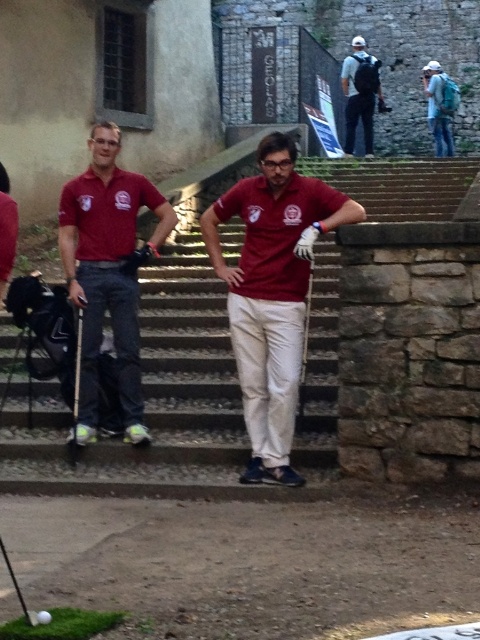
Question: Can you confirm if matte blue backpack at upper right is bigger than matte black golf club at center?

Choices:
 (A) no
 (B) yes

Answer: (B)

Question: Based on their relative distances, which object is farther from the white matte golf ball at center?

Choices:
 (A) matte gray backpack at upper right
 (B) matte blue backpack at upper right
 (C) matte black golf club at center
 (D) matte red polo shirt at center

Answer: (B)

Question: Among these points, which one is farthest from the camera?

Choices:
 (A) 80,356
 (B) 96,400
 (C) 345,60

Answer: (C)

Question: From the image, what is the correct spatial relationship of matte red polo shirt at center in relation to matte black golf club at center?

Choices:
 (A) right
 (B) left

Answer: (A)

Question: Considering the relative positions of matte khaki pants at center and matte red polo shirt at center in the image provided, where is matte khaki pants at center located with respect to matte red polo shirt at center?

Choices:
 (A) above
 (B) below

Answer: (B)

Question: Among these objects, which one is nearest to the camera?

Choices:
 (A) matte khaki pants at center
 (B) matte red polo shirt at center

Answer: (A)